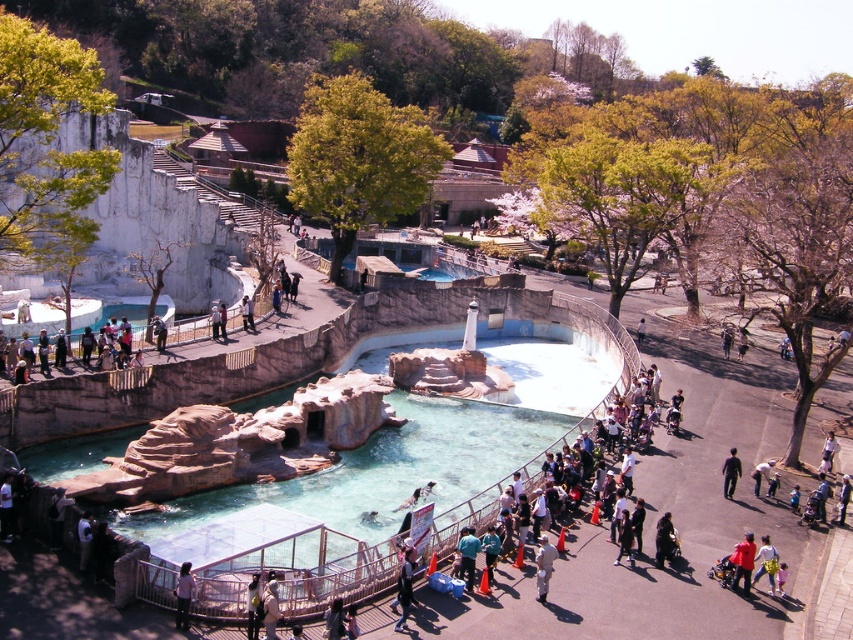
Question: Which of the following is the closest to the observer?

Choices:
 (A) (758, 467)
 (B) (657, 556)

Answer: (B)

Question: Does dark blue jeans at center have a greater width compared to dark brown fur at center?

Choices:
 (A) yes
 (B) no

Answer: (B)

Question: Which of the following is the closest to the observer?

Choices:
 (A) (769, 573)
 (B) (746, 554)

Answer: (A)

Question: In this image, where is clear glass pool at center located relative to light blue denim jacket at lower right?

Choices:
 (A) below
 (B) above

Answer: (B)

Question: Among these points, which one is farthest from the camera?

Choices:
 (A) (496, 352)
 (B) (738, 468)

Answer: (A)

Question: Is red cotton shirt at lower right closer to the viewer compared to light pink fabric pants at lower center?

Choices:
 (A) yes
 (B) no

Answer: (B)